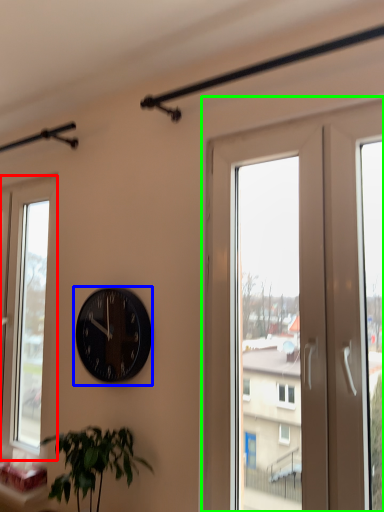
Question: Which is farther away from window (highlighted by a red box)? wall clock (highlighted by a blue box) or screen door (highlighted by a green box)?

Choices:
 (A) wall clock
 (B) screen door

Answer: (B)